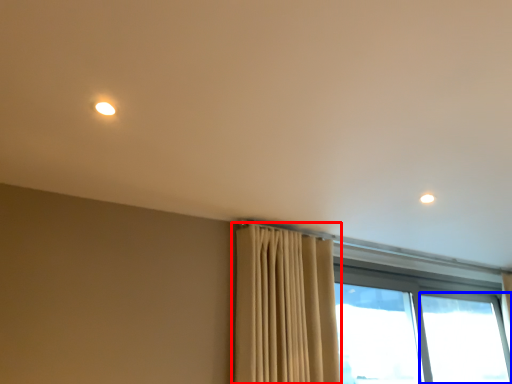
Question: Which point is closer to the camera, curtain (highlighted by a red box) or window (highlighted by a blue box)?

Choices:
 (A) curtain
 (B) window

Answer: (A)